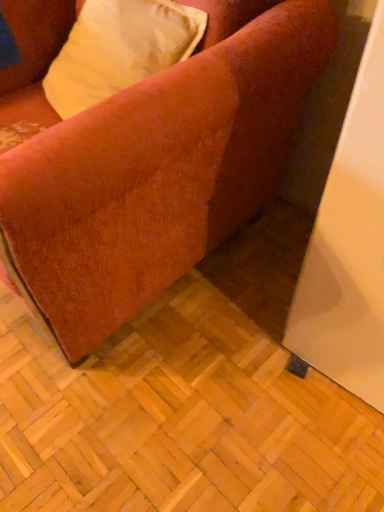
Question: Looking at their shapes, would you say velvet-like beige pillow at upper left is wider or thinner than velvet-like orange couch at lower left?

Choices:
 (A) wide
 (B) thin

Answer: (B)

Question: From the image's perspective, is velvet-like beige pillow at upper left positioned above or below velvet-like orange couch at lower left?

Choices:
 (A) below
 (B) above

Answer: (B)

Question: In the image, is velvet-like beige pillow at upper left on the left side or the right side of velvet-like orange couch at lower left?

Choices:
 (A) right
 (B) left

Answer: (A)

Question: Is point (135, 137) closer or farther from the camera than point (52, 79)?

Choices:
 (A) farther
 (B) closer

Answer: (B)

Question: From the image's perspective, is velvet-like orange couch at lower left located above or below velvet-like beige pillow at upper left?

Choices:
 (A) below
 (B) above

Answer: (A)

Question: Considering the positions of velvet-like orange couch at lower left and velvet-like beige pillow at upper left in the image, is velvet-like orange couch at lower left wider or thinner than velvet-like beige pillow at upper left?

Choices:
 (A) wide
 (B) thin

Answer: (A)

Question: From a real-world perspective, is velvet-like orange couch at lower left positioned above or below velvet-like beige pillow at upper left?

Choices:
 (A) above
 (B) below

Answer: (B)